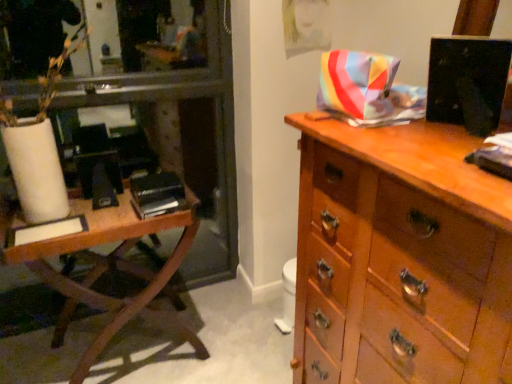
Question: From the image's perspective, is wooden chest of drawers at right beneath wooden table at left?

Choices:
 (A) no
 (B) yes

Answer: (A)

Question: Does wooden chest of drawers at right come in front of wooden table at left?

Choices:
 (A) no
 (B) yes

Answer: (B)

Question: Is wooden chest of drawers at right to the left of wooden table at left from the viewer's perspective?

Choices:
 (A) no
 (B) yes

Answer: (A)

Question: From a real-world perspective, is wooden chest of drawers at right under wooden table at left?

Choices:
 (A) no
 (B) yes

Answer: (A)

Question: Is wooden chest of drawers at right positioned far away from wooden table at left?

Choices:
 (A) no
 (B) yes

Answer: (A)

Question: Is wooden chest of drawers at right wider than wooden table at left?

Choices:
 (A) yes
 (B) no

Answer: (A)

Question: Are black matte book at left and white matte vase at left far apart?

Choices:
 (A) no
 (B) yes

Answer: (A)

Question: From the image's perspective, is black matte book at left on top of white matte vase at left?

Choices:
 (A) no
 (B) yes

Answer: (A)

Question: Is the position of black matte book at left less distant than that of white matte vase at left?

Choices:
 (A) yes
 (B) no

Answer: (B)

Question: Is black matte book at left positioned behind white matte vase at left?

Choices:
 (A) no
 (B) yes

Answer: (B)

Question: Is black matte book at left at the right side of white matte vase at left?

Choices:
 (A) yes
 (B) no

Answer: (A)

Question: Does black matte book at left have a lesser width compared to white matte vase at left?

Choices:
 (A) yes
 (B) no

Answer: (B)

Question: Is black matte book at left positioned with its back to wooden table at left?

Choices:
 (A) yes
 (B) no

Answer: (A)